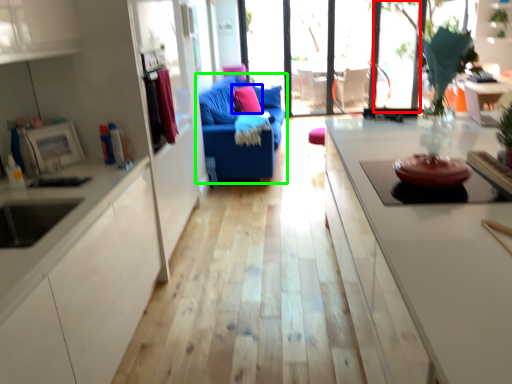
Question: Estimate the real-world distances between objects in this image. Which object is closer to window (highlighted by a red box), pillow (highlighted by a blue box) or studio couch (highlighted by a green box)?

Choices:
 (A) pillow
 (B) studio couch

Answer: (A)